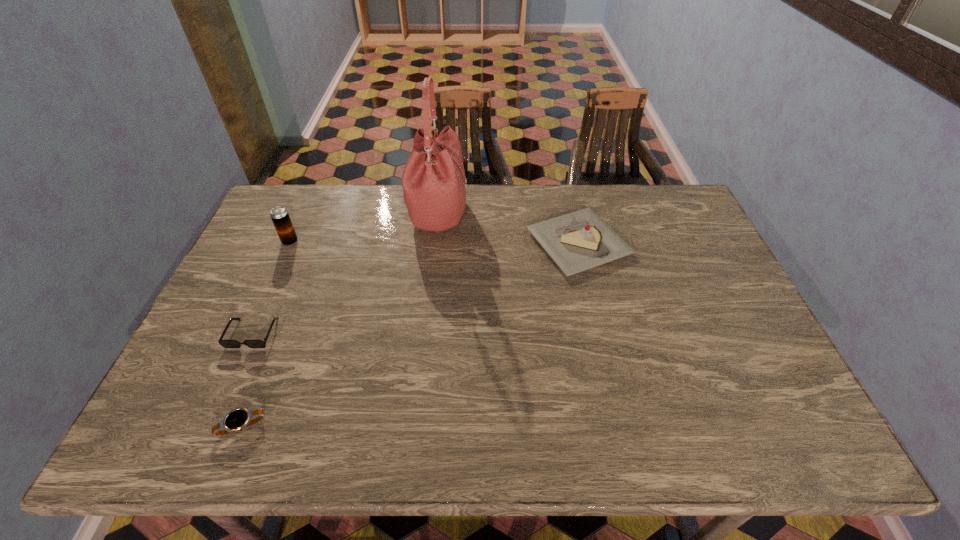
Image resolution: width=960 pixels, height=540 pixels. I want to click on blank region between the watch and the third shortest object, so click(411, 335).

In order to click on free spot between the second tallest object and the nearest object in this screenshot , I will do `click(266, 334)`.

This screenshot has height=540, width=960. I want to click on vacant region between the fourth object from left to right and the second tallest object, so click(365, 227).

Locate an element on the screen. This screenshot has height=540, width=960. vacant area between the second object from right to left and the nearest object is located at coordinates (341, 319).

I want to click on empty location between the fourth farthest object and the rightmost object, so click(416, 288).

I want to click on object identified as the fourth closest to the beer can, so click(x=578, y=241).

This screenshot has width=960, height=540. What are the coordinates of `object that is the closest to the sunglasses` in the screenshot? It's located at (236, 420).

This screenshot has width=960, height=540. Find the location of `blank space that satisfies the following two spatial constraints: 1. on the front-facing side of the sunglasses; 2. on the right side of the nearest object`. blank space that satisfies the following two spatial constraints: 1. on the front-facing side of the sunglasses; 2. on the right side of the nearest object is located at coordinates (211, 427).

The height and width of the screenshot is (540, 960). Identify the location of vacant space that satisfies the following two spatial constraints: 1. on the back side of the rightmost object; 2. on the left side of the watch. 314,244.